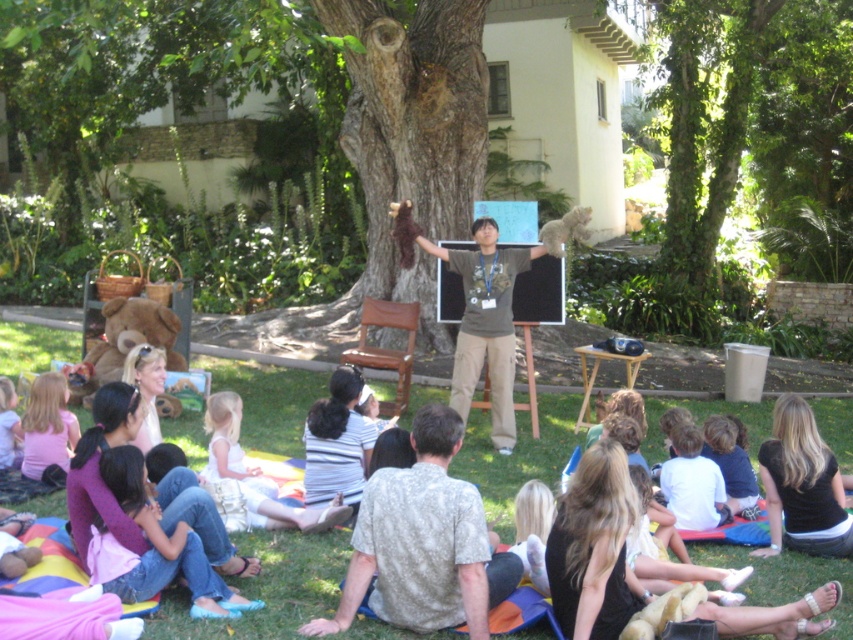
In the scene shown: Is brown rough tree at center to the right of light pink fabric at lower left from the viewer's perspective?

Yes, brown rough tree at center is to the right of light pink fabric at lower left.

Is brown rough tree at center positioned in front of light pink fabric at lower left?

That is False.

Is point (70, 163) behind point (10, 387)?

Yes, it is behind point (10, 387).

What are the coordinates of `brown rough tree at center` in the screenshot? It's located at (189, 104).

Between brown rough tree at center and white cotton dress at center, which one is positioned higher?

brown rough tree at center

Describe the element at coordinates (189, 104) in the screenshot. I see `brown rough tree at center` at that location.

Where is `brown rough tree at center`? The image size is (853, 640). brown rough tree at center is located at coordinates (189, 104).

Which is in front, point (469, 442) or point (15, 465)?

Point (15, 465)

Is green grass at center below light pink fabric at lower left?

Yes, green grass at center is below light pink fabric at lower left.

Does point (836, 410) come closer to viewer compared to point (3, 390)?

No, it is behind (3, 390).

Locate an element on the screen. The width and height of the screenshot is (853, 640). green grass at center is located at coordinates (292, 579).